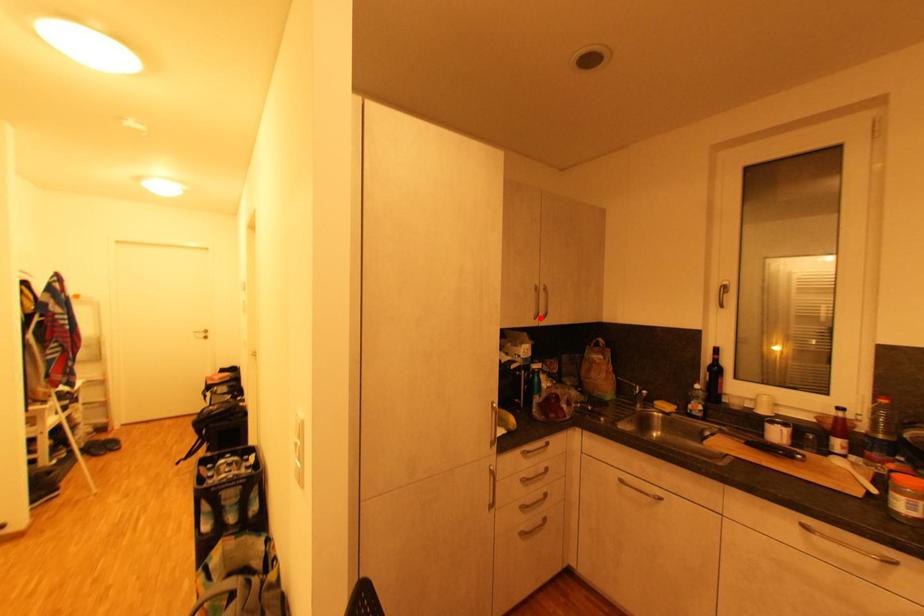
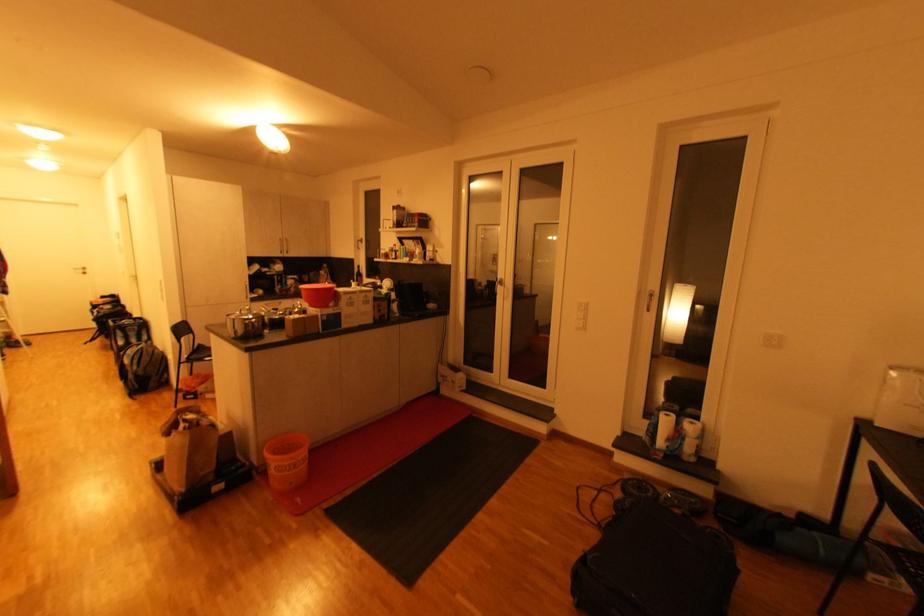
Locate, in the second image, the point that corresponds to the highlighted location in the first image.

(286, 254)